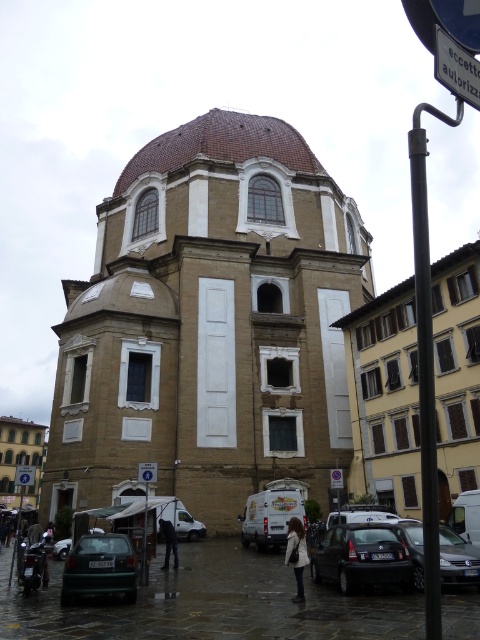
Question: Is white matte van at center positioned before white plastic sign at upper center?

Choices:
 (A) no
 (B) yes

Answer: (A)

Question: Which point is closer to the camera?

Choices:
 (A) (376, 547)
 (B) (420, 570)
 (C) (139, 464)

Answer: (A)

Question: Which object is positioned farthest from the white fabric coat at lower center?

Choices:
 (A) brown stone church at center
 (B) white plastic sign at upper center
 (C) black metal pole at right
 (D) matte beige church at lower left

Answer: (D)

Question: Which point is farther to the camera?

Choices:
 (A) white plastic sign at center
 (B) black matte car at lower center
 (C) white fabric coat at lower center
 (D) matte beige church at lower left

Answer: (A)

Question: Is white plastic sign at upper right positioned behind white plastic sign at center?

Choices:
 (A) yes
 (B) no

Answer: (B)

Question: Is brown stone church at center further to camera compared to silver metallic van at center?

Choices:
 (A) yes
 (B) no

Answer: (A)